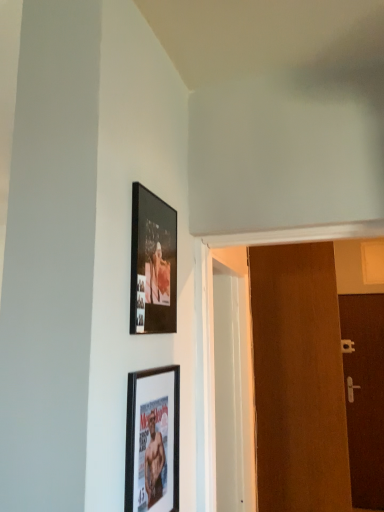
Question: From a real-world perspective, is brown wooden door at right, positioned as the 1th door in left-to-right order, physically above matte black picture frame at lower center, which is the first picture frame in bottom-to-top order?

Choices:
 (A) yes
 (B) no

Answer: (A)

Question: Is brown wooden door at right, the second door when ordered from right to left, at the right side of matte black picture frame at lower center, which is the first picture frame in bottom-to-top order?

Choices:
 (A) yes
 (B) no

Answer: (A)

Question: Does brown wooden door at right, positioned as the 1th door in front-to-back order, have a greater height compared to matte black picture frame at lower center, which is the first picture frame in bottom-to-top order?

Choices:
 (A) yes
 (B) no

Answer: (A)

Question: Can we say brown wooden door at right, positioned as the 1th door in front-to-back order, lies outside matte black picture frame at lower center, marked as the 2th picture frame in a top-to-bottom arrangement?

Choices:
 (A) no
 (B) yes

Answer: (B)

Question: Is brown wooden door at right, the second door when ordered from right to left, oriented towards matte black picture frame at lower center, marked as the 2th picture frame in a top-to-bottom arrangement?

Choices:
 (A) yes
 (B) no

Answer: (A)

Question: Considering the relative sizes of brown wooden door at right, positioned as the 1th door in left-to-right order, and matte black picture frame at lower center, which is the first picture frame in bottom-to-top order, in the image provided, is brown wooden door at right, positioned as the 1th door in left-to-right order, bigger than matte black picture frame at lower center, which is the first picture frame in bottom-to-top order,?

Choices:
 (A) no
 (B) yes

Answer: (B)

Question: Can you confirm if brown wooden door at right, marked as the 2th door in a back-to-front arrangement, is shorter than matte black picture frame at upper center, placed as the 1th picture frame when sorted from top to bottom?

Choices:
 (A) no
 (B) yes

Answer: (A)

Question: Is the surface of brown wooden door at right, positioned as the 1th door in front-to-back order, in direct contact with matte black picture frame at upper center, the 2th picture frame in the bottom-to-top sequence?

Choices:
 (A) yes
 (B) no

Answer: (B)

Question: Can you confirm if brown wooden door at right, positioned as the 1th door in front-to-back order, is bigger than matte black picture frame at upper center, the 2th picture frame in the bottom-to-top sequence?

Choices:
 (A) no
 (B) yes

Answer: (B)

Question: Is brown wooden door at right, positioned as the 1th door in left-to-right order, taller than matte black picture frame at upper center, placed as the 1th picture frame when sorted from top to bottom?

Choices:
 (A) no
 (B) yes

Answer: (B)

Question: Is brown wooden door at right, positioned as the 1th door in left-to-right order, to the left of matte black picture frame at upper center, placed as the 1th picture frame when sorted from top to bottom, from the viewer's perspective?

Choices:
 (A) no
 (B) yes

Answer: (A)

Question: Is brown wooden door at right, marked as the 2th door in a back-to-front arrangement, turned away from matte black picture frame at upper center, the 2th picture frame in the bottom-to-top sequence?

Choices:
 (A) yes
 (B) no

Answer: (B)

Question: From a real-world perspective, is matte black picture frame at lower center, marked as the 2th picture frame in a top-to-bottom arrangement, physically below brown matte door at right, positioned as the second door in front-to-back order?

Choices:
 (A) yes
 (B) no

Answer: (B)